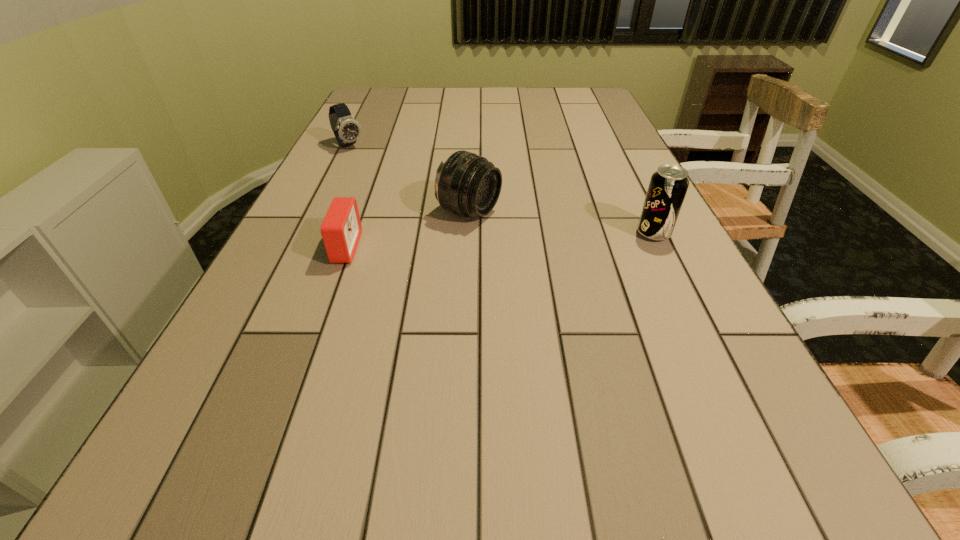
Find the location of a particular element. The height and width of the screenshot is (540, 960). free region located 0.210m on the face of the farthest object is located at coordinates (390, 181).

The width and height of the screenshot is (960, 540). I want to click on blank space located 0.220m at the front element of the second object from right to left, so click(x=584, y=254).

Identify the location of vacant area situated 0.390m at the front element of the second object from right to left. This screenshot has width=960, height=540. (663, 282).

The height and width of the screenshot is (540, 960). I want to click on vacant area situated 0.390m at the front element of the second object from right to left, so click(663, 282).

Find the location of a particular element. Image resolution: width=960 pixels, height=540 pixels. alarm clock positioned at the left edge is located at coordinates (341, 229).

Where is `watch situated at the left edge`? watch situated at the left edge is located at coordinates (346, 129).

You are a GUI agent. You are given a task and a screenshot of the screen. Output one action in this format:
    pyautogui.click(x=<x>, y=<y>)
    Task: Click on the object positioned at the right edge
    The image size is (960, 540).
    Given the screenshot: What is the action you would take?
    pyautogui.click(x=668, y=186)

The image size is (960, 540). In order to click on free region at the far edge in this screenshot , I will do `click(552, 95)`.

This screenshot has height=540, width=960. In the image, there is a desktop. What are the coordinates of `blank space at the near edge` in the screenshot? It's located at (445, 414).

The height and width of the screenshot is (540, 960). In the image, there is a desktop. Find the location of `blank space at the left edge`. blank space at the left edge is located at coordinates (372, 119).